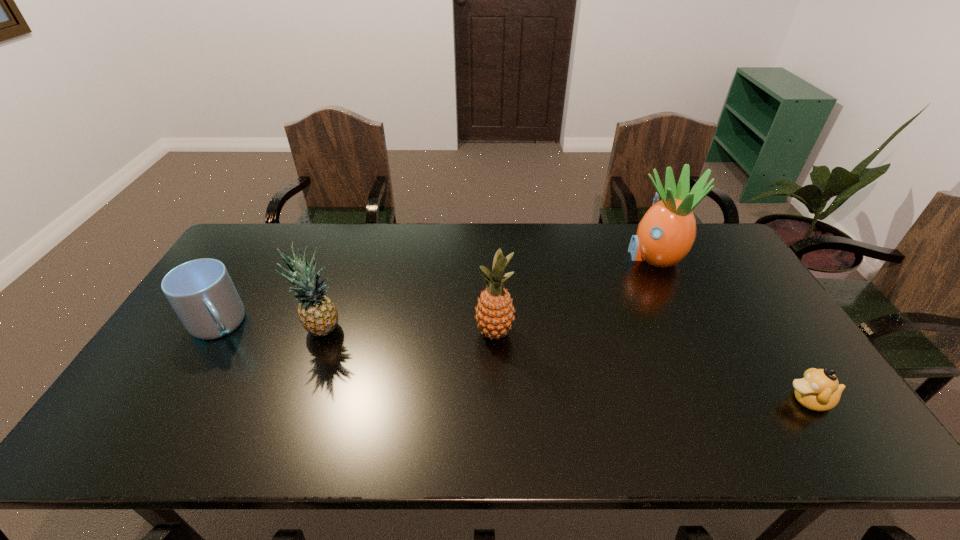
Find the location of `the farthest pineapple`. the farthest pineapple is located at coordinates (665, 235).

This screenshot has width=960, height=540. I want to click on the farthest object, so (665, 235).

Locate an element on the screen. The height and width of the screenshot is (540, 960). the third object from left to right is located at coordinates (494, 313).

Locate an element on the screen. the fourth object from right to left is located at coordinates (317, 313).

The width and height of the screenshot is (960, 540). In order to click on the second shortest object in this screenshot , I will do `click(201, 292)`.

Identify the location of the leftmost object. (201, 292).

Find the location of `the nearest object`. the nearest object is located at coordinates (819, 390).

Locate an element on the screen. Image resolution: width=960 pixels, height=540 pixels. duckling is located at coordinates (819, 390).

I want to click on free space located at the entrance of the second object from right to left, so click(605, 255).

The image size is (960, 540). In order to click on vacant space located 0.170m at the entrance of the second object from right to left in this screenshot , I will do `click(575, 255)`.